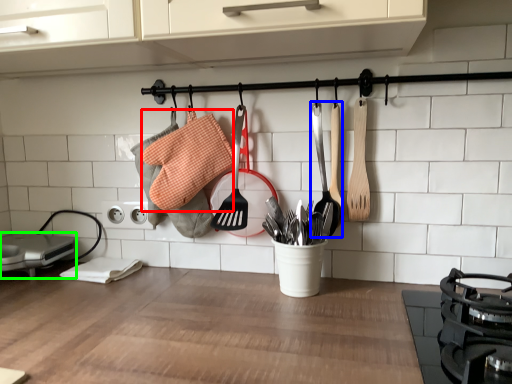
Question: Which object is the farthest from material (highlighted by a red box)? Choose among these: spatula (highlighted by a blue box) or appliance (highlighted by a green box).

Choices:
 (A) spatula
 (B) appliance

Answer: (B)